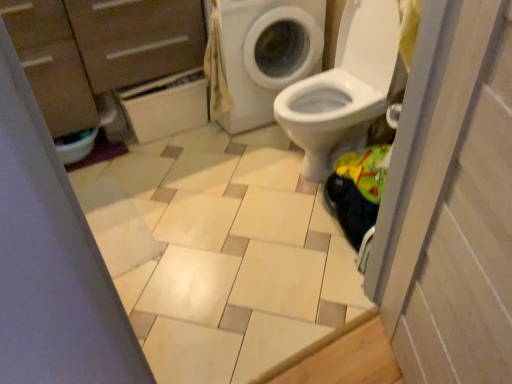
Question: Is beige glossy tile at center smaller than white glossy screen door at right?

Choices:
 (A) yes
 (B) no

Answer: (B)

Question: Is white glossy screen door at right inside beige glossy tile at center?

Choices:
 (A) yes
 (B) no

Answer: (B)

Question: From a real-world perspective, is beige glossy tile at center positioned over white glossy screen door at right based on gravity?

Choices:
 (A) no
 (B) yes

Answer: (A)

Question: Is beige glossy tile at center thinner than white glossy screen door at right?

Choices:
 (A) yes
 (B) no

Answer: (B)

Question: Does beige glossy tile at center have a lesser height compared to white glossy screen door at right?

Choices:
 (A) no
 (B) yes

Answer: (B)

Question: Does beige glossy tile at center turn towards white glossy screen door at right?

Choices:
 (A) no
 (B) yes

Answer: (A)

Question: From the image's perspective, is white glossy screen door at right over beige glossy tile at center?

Choices:
 (A) no
 (B) yes

Answer: (A)

Question: Does white glossy screen door at right have a smaller size compared to beige glossy tile at center?

Choices:
 (A) yes
 (B) no

Answer: (A)

Question: Is white glossy screen door at right oriented away from beige glossy tile at center?

Choices:
 (A) yes
 (B) no

Answer: (B)

Question: Is white glossy screen door at right with beige glossy tile at center?

Choices:
 (A) yes
 (B) no

Answer: (B)

Question: From the image's perspective, is white glossy screen door at right under beige glossy tile at center?

Choices:
 (A) no
 (B) yes

Answer: (B)

Question: Would you consider white glossy screen door at right to be distant from beige glossy tile at center?

Choices:
 (A) no
 (B) yes

Answer: (A)

Question: From the image's perspective, is white glossy screen door at right beneath white matte cabinet at upper left?

Choices:
 (A) yes
 (B) no

Answer: (A)